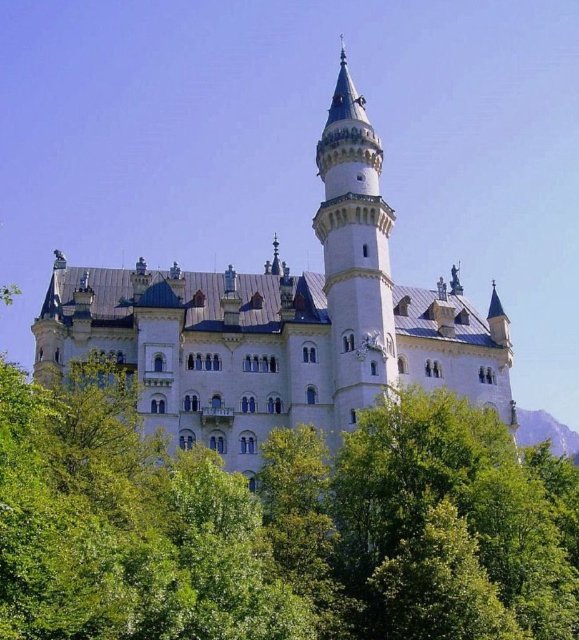
You are a drone operator tasked with capturing aerial footage of the white stone castle at center and the green grassy hill at lower right. Your drone has a maximum flight altitude of 100 meters. Considering the height difference between the two, will you need to adjust your flight path to ensure both are visible in the same frame?

The white stone castle at center is taller than the green grassy hill at lower right, so you will need to adjust your flight path to ensure both are visible in the same frame. Flying at an altitude where the drone can capture both the taller castle and the lower hill might require positioning the drone higher or angling the camera appropriately to include both elements within the frame.

You are a bird flying over the green grassy hill at lower right and want to land on the white stone tower at center. Can you fly upwards to reach it?

The white stone tower at center is above the green grassy hill at lower right, so yes, you can fly upwards to reach it from the hill.